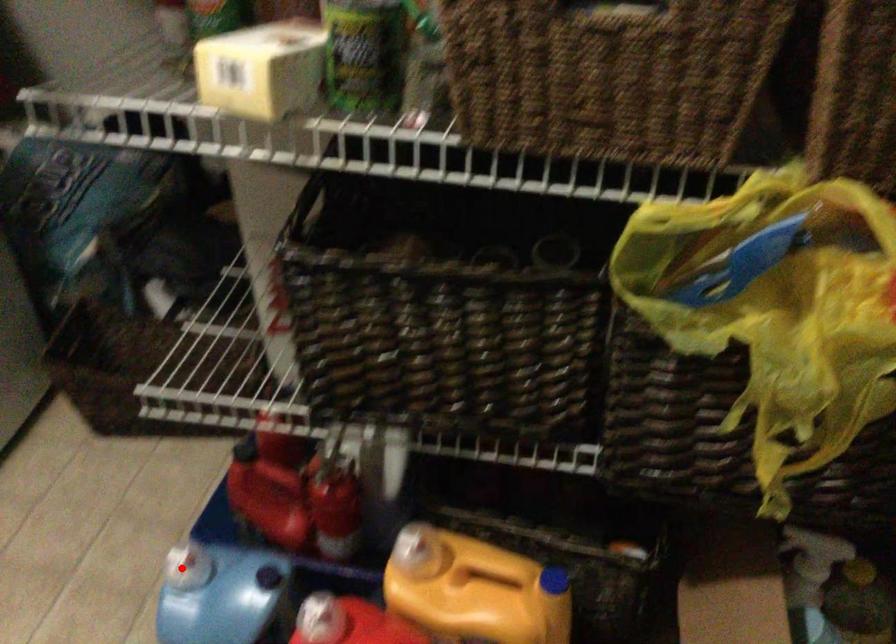
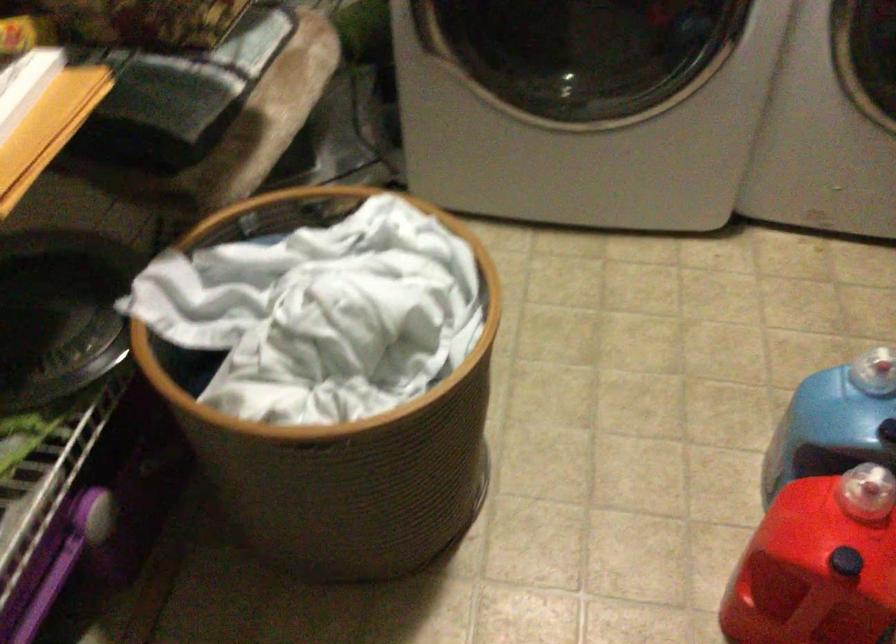
Find the pixel in the second image that matches the highlighted location in the first image.

(872, 373)